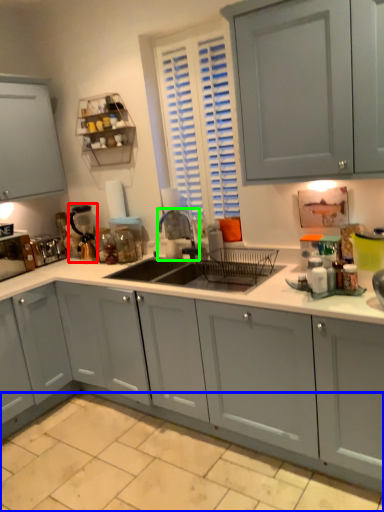
Question: Which object is the closest to the appliance (highlighted by a red box)? Choose among these: tile (highlighted by a blue box) or faucet (highlighted by a green box).

Choices:
 (A) tile
 (B) faucet

Answer: (B)